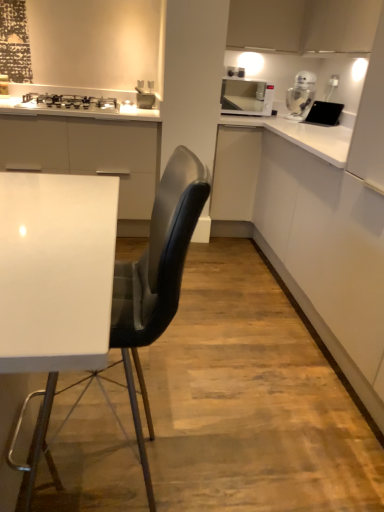
Question: Should I look upward or downward to see matte white cabinet at upper right?

Choices:
 (A) up
 (B) down

Answer: (A)

Question: Does white glossy microwave at upper right have a lesser width compared to matte white cabinet at upper right?

Choices:
 (A) yes
 (B) no

Answer: (A)

Question: From a real-world perspective, is white glossy microwave at upper right under matte white cabinet at upper right?

Choices:
 (A) no
 (B) yes

Answer: (B)

Question: Is white glossy microwave at upper right to the left of matte white cabinet at upper right from the viewer's perspective?

Choices:
 (A) yes
 (B) no

Answer: (A)

Question: From the image's perspective, is white glossy microwave at upper right located above matte white cabinet at upper right?

Choices:
 (A) no
 (B) yes

Answer: (A)

Question: Does white glossy microwave at upper right turn towards matte white cabinet at upper right?

Choices:
 (A) yes
 (B) no

Answer: (B)

Question: Does white glossy microwave at upper right come in front of matte white cabinet at upper right?

Choices:
 (A) yes
 (B) no

Answer: (B)

Question: Is matte white cabinet at upper right bigger than clear glass jar at upper right?

Choices:
 (A) no
 (B) yes

Answer: (B)

Question: Is matte white cabinet at upper right oriented away from clear glass jar at upper right?

Choices:
 (A) no
 (B) yes

Answer: (A)

Question: From a real-world perspective, is matte white cabinet at upper right located higher than clear glass jar at upper right?

Choices:
 (A) yes
 (B) no

Answer: (A)

Question: Is matte white cabinet at upper right far from clear glass jar at upper right?

Choices:
 (A) no
 (B) yes

Answer: (A)

Question: Can you confirm if matte white cabinet at upper right is smaller than clear glass jar at upper right?

Choices:
 (A) no
 (B) yes

Answer: (A)

Question: Does matte white cabinet at upper right have a greater height compared to clear glass jar at upper right?

Choices:
 (A) yes
 (B) no

Answer: (A)

Question: From the image's perspective, is white glossy microwave at upper right over black leather chair at center?

Choices:
 (A) no
 (B) yes

Answer: (B)